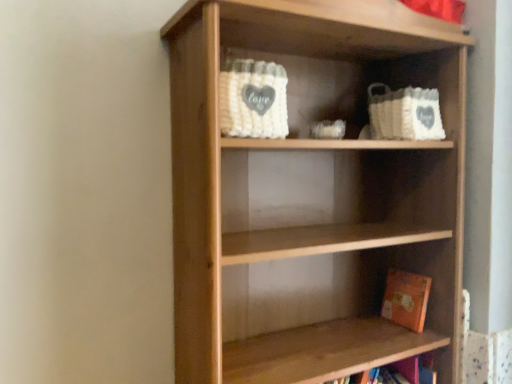
Question: In the image, is orange matte book at lower right positioned in front of or behind natural wood shelf at center?

Choices:
 (A) front
 (B) behind

Answer: (B)

Question: In terms of width, does orange matte book at lower right look wider or thinner when compared to natural wood shelf at center?

Choices:
 (A) thin
 (B) wide

Answer: (A)

Question: Does point (404, 274) appear closer or farther from the camera than point (214, 8)?

Choices:
 (A) closer
 (B) farther

Answer: (B)

Question: From a real-world perspective, is natural wood shelf at center above or below orange matte book at lower right?

Choices:
 (A) above
 (B) below

Answer: (A)

Question: Is natural wood shelf at center wider or thinner than orange matte book at lower right?

Choices:
 (A) wide
 (B) thin

Answer: (A)

Question: From the image's perspective, is natural wood shelf at center located above or below orange matte book at lower right?

Choices:
 (A) above
 (B) below

Answer: (A)

Question: In terms of size, does natural wood shelf at center appear bigger or smaller than orange matte book at lower right?

Choices:
 (A) big
 (B) small

Answer: (A)